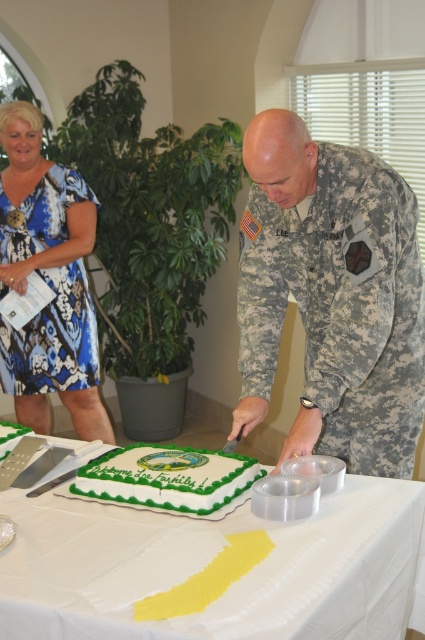
You are a photographer at the event and need to capture a photo of both the camouflage uniform at center and the green frosted cake at center. Based on their sizes, which one should you focus on first to ensure it fits in the frame?

The camouflage uniform at center is much taller than the green frosted cake at center, so you should focus on capturing the camouflage uniform at center first to ensure it fits in the frame.

You are attending a formal event and see the camouflage fabric uniform at center and the green frosted cake at center. Which object is closer to you?

The camouflage fabric uniform at center is closer to you because it is positioned over the green frosted cake at center.

You are attending a formal event and need to determine if the blue printed dress at upper left can fit into a storage box designed to hold items up to the width of the green frosted cake at center. Based on the scene, can the dress fit?

The blue printed dress at upper left has a lesser width compared to the green frosted cake at center, so the dress can fit into the storage box designed for the cake.